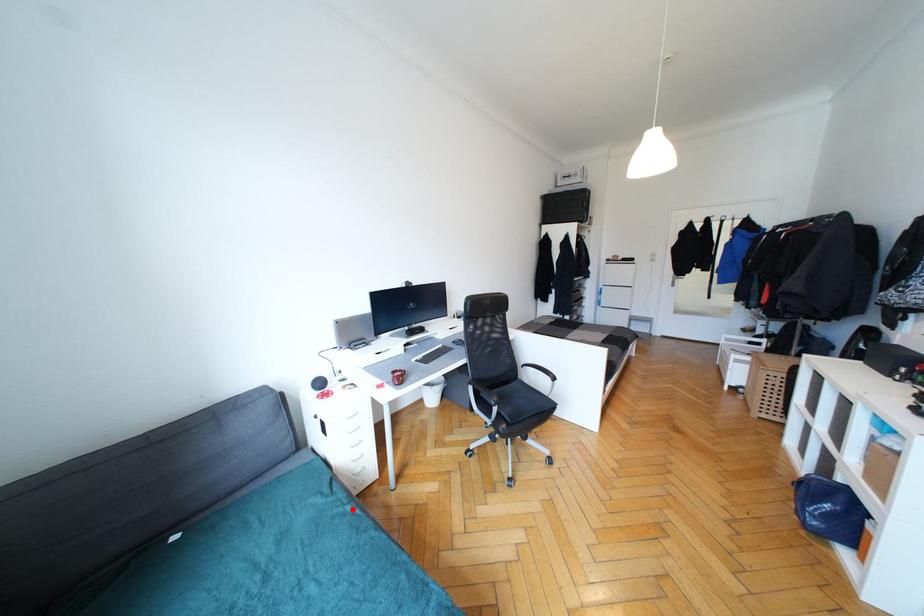
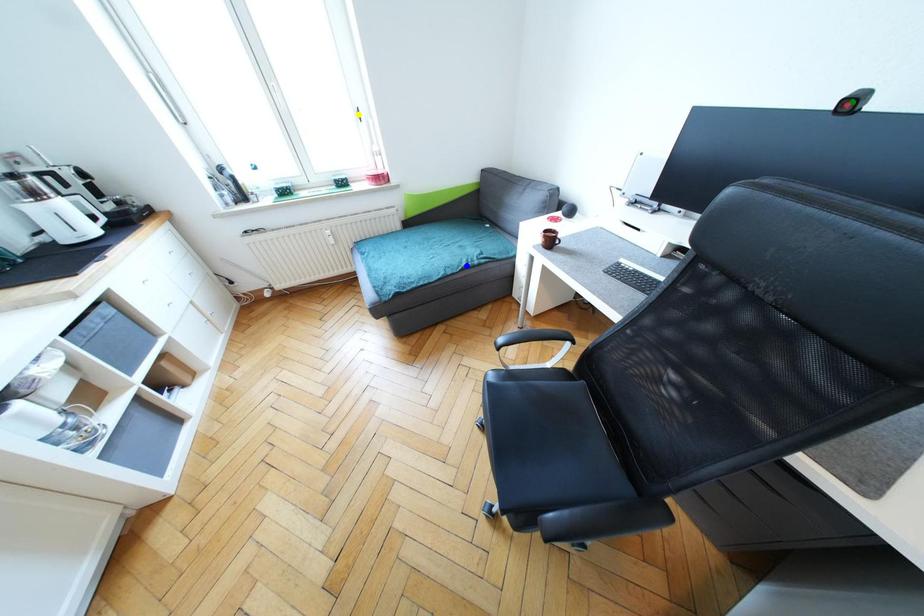
Question: I am providing you with two images of the same scene from different viewpoints. A red point is marked on the first image. You are given multiple points on the second image. Which spot in image 2 lines up with the point in image 1?

Choices:
 (A) green point
 (B) yellow point
 (C) blue point

Answer: (C)